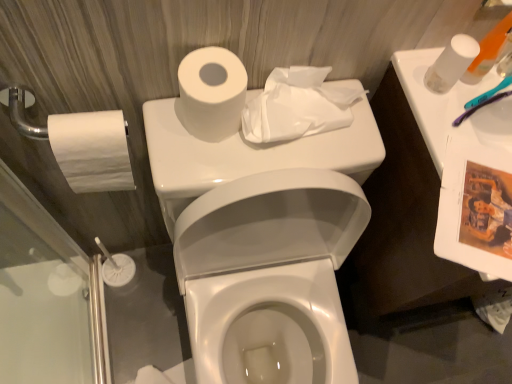
This screenshot has height=384, width=512. What do you see at coordinates (490, 48) in the screenshot? I see `white plastic toothbrush at upper right, positioned as the first toiletry in left-to-right order` at bounding box center [490, 48].

The image size is (512, 384). Find the location of `white matte tissue at upper center, the third toilet paper in the left-to-right sequence`. white matte tissue at upper center, the third toilet paper in the left-to-right sequence is located at coordinates (297, 106).

Locate an element on the screen. This screenshot has height=384, width=512. white matte toilet paper at upper right, positioned as the first toilet paper in right-to-left order is located at coordinates (451, 63).

What is the approximate width of white matte toilet paper at upper right, positioned as the first toilet paper in right-to-left order?

1.90 inches.

Locate an element on the screen. The image size is (512, 384). white matte toilet paper at upper center, acting as the second toilet paper starting from the left is located at coordinates (211, 93).

This screenshot has height=384, width=512. What do you see at coordinates (505, 66) in the screenshot?
I see `translucent plastic toothbrush at upper right, the second toiletry in the left-to-right sequence` at bounding box center [505, 66].

Locate an element on the screen. translucent plastic toothbrush at upper right, the second toiletry in the left-to-right sequence is located at coordinates point(505,66).

The width and height of the screenshot is (512, 384). I want to click on white matte toilet paper at left, the 1th toilet paper when ordered from left to right, so click(92, 150).

At what (x,y) coordinates should I click in order to perform the action: click on white plastic toothbrush at upper right, the 2th toiletry from the right. Please return your answer as a coordinate pair (x, y). Looking at the image, I should click on (490, 48).

Is white matte toilet paper at left, the 1th toilet paper when ordered from left to right, in front of or behind white matte toilet paper at upper center, acting as the second toilet paper starting from the left, in the image?

Visually, white matte toilet paper at left, the 1th toilet paper when ordered from left to right, is located behind white matte toilet paper at upper center, acting as the second toilet paper starting from the left.

From a real-world perspective, which toilet paper is the 2nd one above the white matte toilet paper at left, the 1th toilet paper when ordered from left to right? Please provide its 2D coordinates.

[(211, 93)]

Could you measure the distance between white matte toilet paper at left, the fourth toilet paper positioned from the right, and white matte toilet paper at upper center, which appears as the third toilet paper when viewed from the right?

white matte toilet paper at left, the fourth toilet paper positioned from the right, is 6.22 inches from white matte toilet paper at upper center, which appears as the third toilet paper when viewed from the right.

Which is less distant, (57, 146) or (195, 135)?

Point (57, 146).

Is white matte tissue at upper center, the 2th toilet paper when ordered from right to left, spatially inside white matte toilet paper at upper right, the 4th toilet paper in the left-to-right sequence, or outside of it?

The correct answer is: outside.

From the image's perspective, is white matte tissue at upper center, the third toilet paper in the left-to-right sequence, below white matte toilet paper at upper right, positioned as the first toilet paper in right-to-left order?

Yes.

Considering the sizes of objects white matte tissue at upper center, the third toilet paper in the left-to-right sequence, and white matte toilet paper at upper right, the 4th toilet paper in the left-to-right sequence, in the image provided, who is thinner, white matte tissue at upper center, the third toilet paper in the left-to-right sequence, or white matte toilet paper at upper right, the 4th toilet paper in the left-to-right sequence,?

white matte toilet paper at upper right, the 4th toilet paper in the left-to-right sequence.

In terms of width, does white matte toilet paper at left, the fourth toilet paper positioned from the right, look wider or thinner when compared to white plastic toothbrush at upper right, the 2th toiletry from the right?

Clearly, white matte toilet paper at left, the fourth toilet paper positioned from the right, has more width compared to white plastic toothbrush at upper right, the 2th toiletry from the right.

Is white matte toilet paper at left, the fourth toilet paper positioned from the right, at the right side of white plastic toothbrush at upper right, positioned as the first toiletry in left-to-right order?

Incorrect, white matte toilet paper at left, the fourth toilet paper positioned from the right, is not on the right side of white plastic toothbrush at upper right, positioned as the first toiletry in left-to-right order.

From a real-world perspective, between white matte toilet paper at left, the fourth toilet paper positioned from the right, and white plastic toothbrush at upper right, the 2th toiletry from the right, who is vertically lower?

white matte toilet paper at left, the fourth toilet paper positioned from the right, from a real-world perspective.

Can you confirm if white matte toilet paper at left, the 1th toilet paper when ordered from left to right, is taller than white plastic toothbrush at upper right, positioned as the first toiletry in left-to-right order?

Yes, white matte toilet paper at left, the 1th toilet paper when ordered from left to right, is taller than white plastic toothbrush at upper right, positioned as the first toiletry in left-to-right order.

From the image's perspective, starting from the white matte tissue at upper center, the third toilet paper in the left-to-right sequence, which toilet paper is the 1st one above? Please provide its 2D coordinates.

[(211, 93)]

Is white matte tissue at upper center, the third toilet paper in the left-to-right sequence, inside or outside of white matte toilet paper at upper center, acting as the second toilet paper starting from the left?

white matte tissue at upper center, the third toilet paper in the left-to-right sequence, is spatially situated outside white matte toilet paper at upper center, acting as the second toilet paper starting from the left.

Who is bigger, white matte tissue at upper center, the third toilet paper in the left-to-right sequence, or white matte toilet paper at upper center, which appears as the third toilet paper when viewed from the right?

white matte tissue at upper center, the third toilet paper in the left-to-right sequence, is bigger.

Which is nearer, [345,95] or [223,135]?

Point [345,95].

How different are the orientations of white matte toilet paper at upper right, the 4th toilet paper in the left-to-right sequence, and white plastic toothbrush at upper right, positioned as the first toiletry in left-to-right order, in degrees?

white matte toilet paper at upper right, the 4th toilet paper in the left-to-right sequence, and white plastic toothbrush at upper right, positioned as the first toiletry in left-to-right order, are facing 44.3 degrees away from each other.

From the image's perspective, is white matte toilet paper at upper right, positioned as the first toilet paper in right-to-left order, above or below white plastic toothbrush at upper right, positioned as the first toiletry in left-to-right order?

From the image's perspective, white matte toilet paper at upper right, positioned as the first toilet paper in right-to-left order, appears below white plastic toothbrush at upper right, positioned as the first toiletry in left-to-right order.

Between white matte toilet paper at upper right, the 4th toilet paper in the left-to-right sequence, and white plastic toothbrush at upper right, positioned as the first toiletry in left-to-right order, which one has smaller size?

With smaller size is white matte toilet paper at upper right, the 4th toilet paper in the left-to-right sequence.

Which is more distant, (470, 52) or (476, 77)?

The point (476, 77) is farther.

Looking at the image, does white matte toilet paper at upper center, acting as the second toilet paper starting from the left, seem bigger or smaller compared to white matte tissue at upper center, the 2th toilet paper when ordered from right to left?

In the image, white matte toilet paper at upper center, acting as the second toilet paper starting from the left, appears to be smaller than white matte tissue at upper center, the 2th toilet paper when ordered from right to left.

Looking at this image, is white matte toilet paper at upper center, acting as the second toilet paper starting from the left, not inside white matte tissue at upper center, the third toilet paper in the left-to-right sequence?

Yes.

From a real-world perspective, which object rests below the other?

white matte tissue at upper center, the third toilet paper in the left-to-right sequence.

Between white matte toilet paper at upper center, which appears as the third toilet paper when viewed from the right, and white matte tissue at upper center, the 2th toilet paper when ordered from right to left, which one appears on the right side from the viewer's perspective?

white matte tissue at upper center, the 2th toilet paper when ordered from right to left.

Would you consider white matte toilet paper at upper center, which appears as the third toilet paper when viewed from the right, to be distant from white matte toilet paper at upper right, positioned as the first toilet paper in right-to-left order?

No.

From a real-world perspective, is white matte toilet paper at upper center, which appears as the third toilet paper when viewed from the right, over white matte toilet paper at upper right, positioned as the first toilet paper in right-to-left order?

No.

From the image's perspective, between white matte toilet paper at upper center, which appears as the third toilet paper when viewed from the right, and white matte toilet paper at upper right, positioned as the first toilet paper in right-to-left order, which one is located above?

From the image's view, white matte toilet paper at upper right, positioned as the first toilet paper in right-to-left order, is above.

Visually, is white matte toilet paper at upper center, which appears as the third toilet paper when viewed from the right, positioned to the left or to the right of white matte toilet paper at upper right, the 4th toilet paper in the left-to-right sequence?

In the image, white matte toilet paper at upper center, which appears as the third toilet paper when viewed from the right, appears on the left side of white matte toilet paper at upper right, the 4th toilet paper in the left-to-right sequence.

This screenshot has height=384, width=512. In order to click on toilet paper in front of the white matte toilet paper at left, the fourth toilet paper positioned from the right in this screenshot , I will do `click(211, 93)`.

From the white matte toilet paper at upper right, the 4th toilet paper in the left-to-right sequence, count the 1st toilet paper to the left and point to it. Please provide its 2D coordinates.

[(297, 106)]

Estimate the real-world distances between objects in this image. Which object is closer to white matte toilet paper at upper center, which appears as the third toilet paper when viewed from the right, white matte toilet paper at left, the fourth toilet paper positioned from the right, or white matte tissue at upper center, the third toilet paper in the left-to-right sequence?

white matte tissue at upper center, the third toilet paper in the left-to-right sequence.

When comparing their distances from white plastic toothbrush at upper right, positioned as the first toiletry in left-to-right order, does white matte tissue at upper center, the third toilet paper in the left-to-right sequence, or white matte toilet paper at left, the fourth toilet paper positioned from the right, seem closer?

The object closer to white plastic toothbrush at upper right, positioned as the first toiletry in left-to-right order, is white matte tissue at upper center, the third toilet paper in the left-to-right sequence.

Which object lies further to the anchor point translucent plastic toothbrush at upper right, the second toiletry in the left-to-right sequence, white matte toilet paper at upper right, positioned as the first toilet paper in right-to-left order, or white plastic toothbrush at upper right, the 2th toiletry from the right?

white matte toilet paper at upper right, positioned as the first toilet paper in right-to-left order, is further to translucent plastic toothbrush at upper right, the second toiletry in the left-to-right sequence.

Considering their positions, is translucent plastic toothbrush at upper right, the second toiletry in the left-to-right sequence, positioned closer to white glossy toilet at center than white matte toilet paper at left, the fourth toilet paper positioned from the right?

Based on the image, white matte toilet paper at left, the fourth toilet paper positioned from the right, appears to be nearer to white glossy toilet at center.

From the image, which object appears to be farther from white matte toilet paper at left, the 1th toilet paper when ordered from left to right, white plastic toothbrush at upper right, positioned as the first toiletry in left-to-right order, or translucent plastic toothbrush at upper right, the second toiletry in the left-to-right sequence?

translucent plastic toothbrush at upper right, the second toiletry in the left-to-right sequence, is further to white matte toilet paper at left, the 1th toilet paper when ordered from left to right.

Considering their positions, is translucent plastic toothbrush at upper right, the first toiletry when ordered from right to left, positioned closer to white matte toilet paper at left, the fourth toilet paper positioned from the right, than white matte toilet paper at upper center, which appears as the third toilet paper when viewed from the right?

white matte toilet paper at upper center, which appears as the third toilet paper when viewed from the right, is positioned closer to the anchor white matte toilet paper at left, the fourth toilet paper positioned from the right.

From the image, which object appears to be nearer to white matte tissue at upper center, the third toilet paper in the left-to-right sequence, white matte toilet paper at upper center, acting as the second toilet paper starting from the left, or white glossy toilet at center?

The object closer to white matte tissue at upper center, the third toilet paper in the left-to-right sequence, is white matte toilet paper at upper center, acting as the second toilet paper starting from the left.

In the scene shown: Which object lies nearer to the anchor point white glossy toilet at center, white plastic toothbrush at upper right, the 2th toiletry from the right, or white matte toilet paper at left, the 1th toilet paper when ordered from left to right?

white matte toilet paper at left, the 1th toilet paper when ordered from left to right, lies closer to white glossy toilet at center than the other object.

The width and height of the screenshot is (512, 384). In order to click on toilet between white matte toilet paper at upper center, acting as the second toilet paper starting from the left, and translucent plastic toothbrush at upper right, the first toiletry when ordered from right to left in this screenshot , I will do `click(268, 275)`.

Where is `toiletry between white plastic toothbrush at upper right, positioned as the first toiletry in left-to-right order, and white glossy toilet at center in the up-down direction`? This screenshot has height=384, width=512. toiletry between white plastic toothbrush at upper right, positioned as the first toiletry in left-to-right order, and white glossy toilet at center in the up-down direction is located at coordinates (505, 66).

You are a GUI agent. You are given a task and a screenshot of the screen. Output one action in this format:
    pyautogui.click(x=<x>, y=<y>)
    Task: Click on the toilet paper between white matte toilet paper at left, the 1th toilet paper when ordered from left to right, and white matte tissue at upper center, the 2th toilet paper when ordered from right to left, in the horizontal direction
    Image resolution: width=512 pixels, height=384 pixels.
    Given the screenshot: What is the action you would take?
    pyautogui.click(x=211, y=93)

Find the location of a particular element. Image resolution: width=512 pixels, height=384 pixels. toilet situated between white matte toilet paper at left, the fourth toilet paper positioned from the right, and white plastic toothbrush at upper right, the 2th toiletry from the right, from left to right is located at coordinates (268, 275).